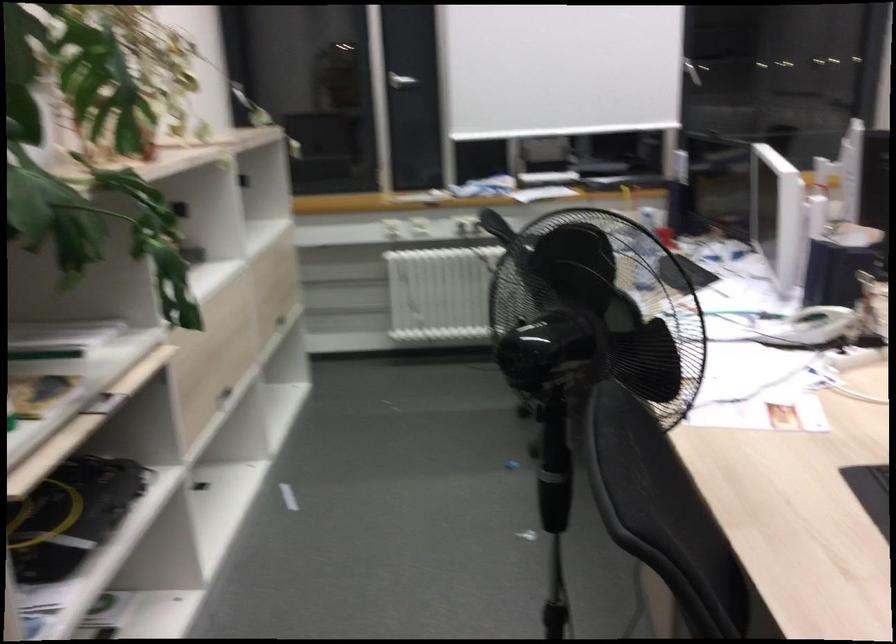
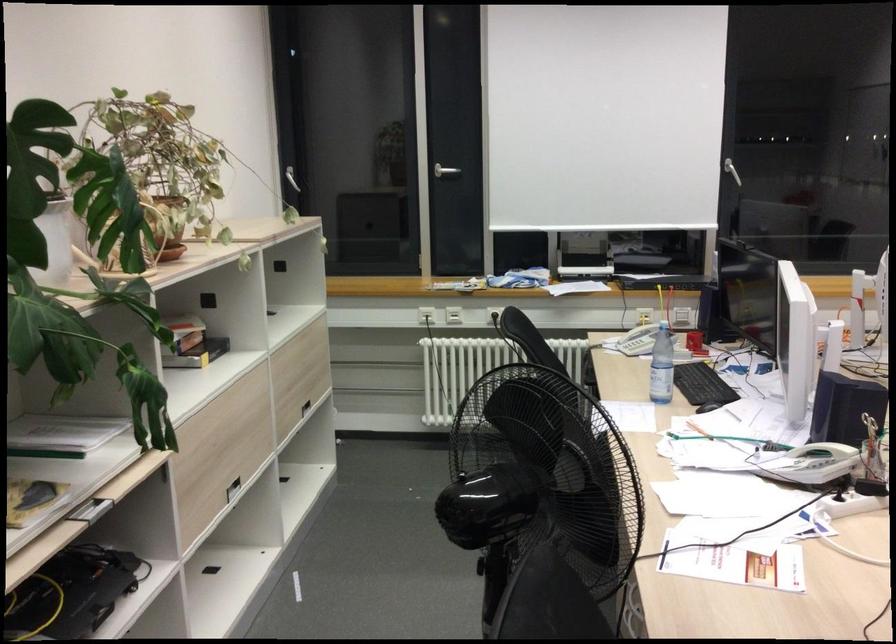
Question: I am providing you with two images of the same scene from different viewpoints. After the viewpoint changes to image2, which objects are now occluded?

Choices:
 (A) stack of books
 (B) silver door handle
 (C) drawer handle
 (D) none of these

Answer: (D)